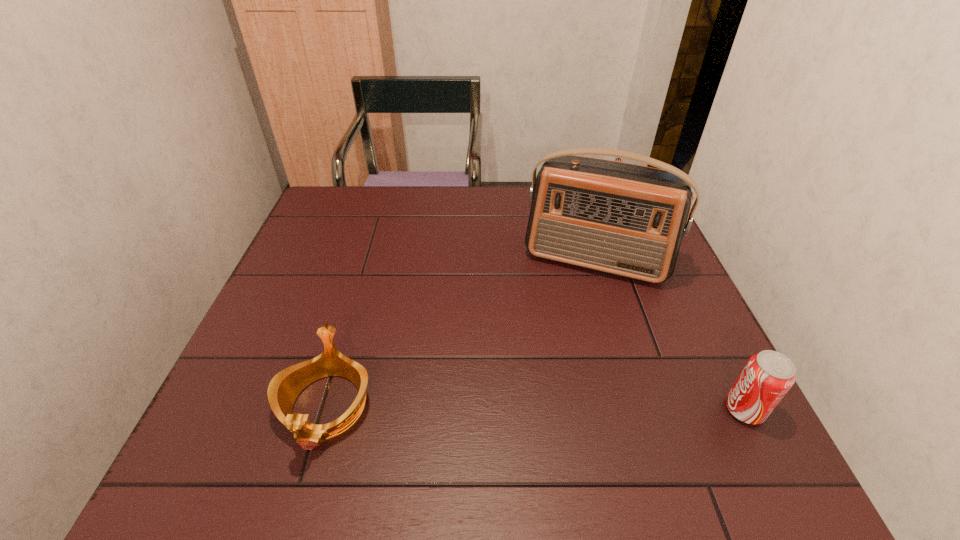
I want to click on free spot on the desktop that is between the tiara and the soda can and is positioned on the front-facing side of the tallest object, so click(555, 408).

This screenshot has width=960, height=540. Find the location of `vacant space on the desktop that is between the leftmost object and the soda can and is positioned on the front-facing side of the farthest object`. vacant space on the desktop that is between the leftmost object and the soda can and is positioned on the front-facing side of the farthest object is located at coordinates (591, 408).